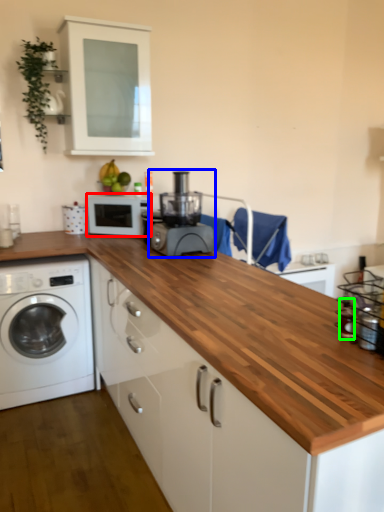
Question: Estimate the real-world distances between objects in this image. Which object is farther from microwave oven (highlighted by a red box), home appliance (highlighted by a blue box) or bottle (highlighted by a green box)?

Choices:
 (A) home appliance
 (B) bottle

Answer: (B)